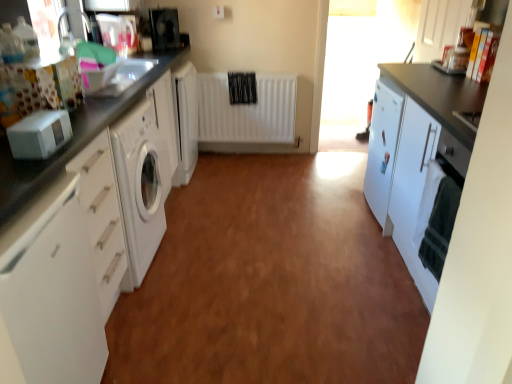
Question: Is black glossy microwave at upper left, which is the 2th appliance from front to back, located outside white matte radiator at center?

Choices:
 (A) no
 (B) yes

Answer: (B)

Question: Is the depth of black glossy microwave at upper left, which is counted as the 2th appliance, starting from the bottom, greater than that of white matte radiator at center?

Choices:
 (A) yes
 (B) no

Answer: (B)

Question: Is black glossy microwave at upper left, which is the 2th appliance from front to back, surrounding white matte radiator at center?

Choices:
 (A) yes
 (B) no

Answer: (B)

Question: Is black glossy microwave at upper left, the first appliance in the back-to-front sequence, at the left side of white matte radiator at center?

Choices:
 (A) yes
 (B) no

Answer: (A)

Question: Is black glossy microwave at upper left, which is the 2th appliance from front to back, to the right of white matte radiator at center from the viewer's perspective?

Choices:
 (A) no
 (B) yes

Answer: (A)

Question: Can you confirm if black glossy microwave at upper left, which is the 2th appliance from front to back, is bigger than white matte radiator at center?

Choices:
 (A) no
 (B) yes

Answer: (A)

Question: Considering the relative positions of white glossy cabinet at left, arranged as the fourth cabinetry when viewed from the right, and transparent glass window screen at upper right in the image provided, is white glossy cabinet at left, arranged as the fourth cabinetry when viewed from the right, behind transparent glass window screen at upper right?

Choices:
 (A) no
 (B) yes

Answer: (A)

Question: Is white glossy cabinet at left, acting as the first cabinetry starting from the left, not within transparent glass window screen at upper right?

Choices:
 (A) no
 (B) yes

Answer: (B)

Question: From the image's perspective, is white glossy cabinet at left, acting as the first cabinetry starting from the left, under transparent glass window screen at upper right?

Choices:
 (A) yes
 (B) no

Answer: (A)

Question: Does white glossy cabinet at left, acting as the first cabinetry starting from the left, have a smaller size compared to transparent glass window screen at upper right?

Choices:
 (A) no
 (B) yes

Answer: (A)

Question: From a real-world perspective, is white glossy cabinet at left, acting as the first cabinetry starting from the left, physically above transparent glass window screen at upper right?

Choices:
 (A) no
 (B) yes

Answer: (A)

Question: Considering the relative positions of white glossy cabinet at left, arranged as the fourth cabinetry when viewed from the right, and transparent glass window screen at upper right in the image provided, is white glossy cabinet at left, arranged as the fourth cabinetry when viewed from the right, to the right of transparent glass window screen at upper right from the viewer's perspective?

Choices:
 (A) yes
 (B) no

Answer: (B)

Question: Is white matte cabinet at right, the second cabinetry in the right-to-left sequence, in front of transparent glass window screen at upper right?

Choices:
 (A) no
 (B) yes

Answer: (B)